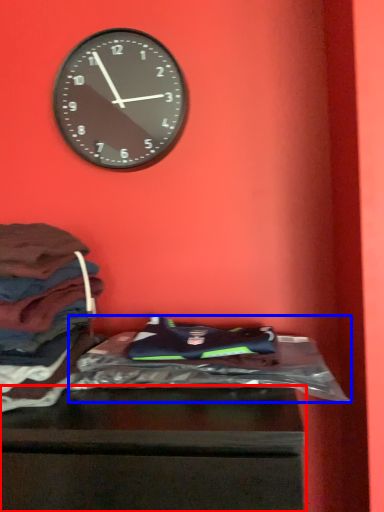
Question: Which object appears closest to the camera in this image, furniture (highlighted by a red box) or material (highlighted by a blue box)?

Choices:
 (A) furniture
 (B) material

Answer: (A)